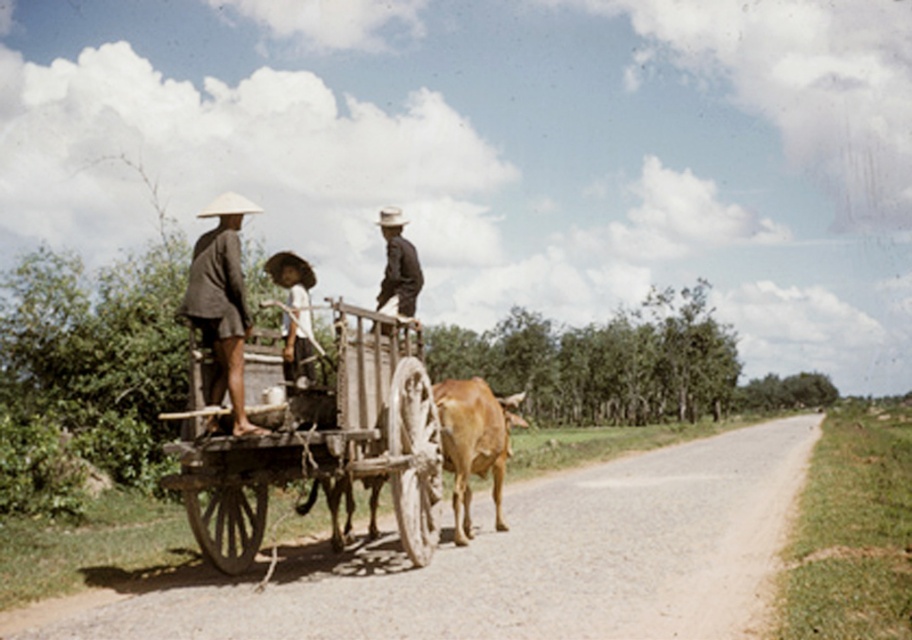
Can you confirm if brown woven hat at upper left is positioned below brown glossy bull at center?

Actually, brown woven hat at upper left is above brown glossy bull at center.

What do you see at coordinates (223, 304) in the screenshot? I see `brown woven hat at upper left` at bounding box center [223, 304].

Locate an element on the screen. The width and height of the screenshot is (912, 640). brown woven hat at upper left is located at coordinates (223, 304).

How distant is brown glossy bull at center from brown straw hat at upper center?

brown glossy bull at center and brown straw hat at upper center are 11.15 feet apart from each other.

Who is positioned more to the right, brown glossy bull at center or brown straw hat at upper center?

brown glossy bull at center

You are a GUI agent. You are given a task and a screenshot of the screen. Output one action in this format:
    pyautogui.click(x=<x>, y=<y>)
    Task: Click on the brown glossy bull at center
    The image size is (912, 640).
    Given the screenshot: What is the action you would take?
    pyautogui.click(x=474, y=442)

From the picture: Who is higher up, brown woven hat at upper left or brown straw hat at upper center?

Positioned higher is brown woven hat at upper left.

Between brown woven hat at upper left and brown straw hat at upper center, which one has more height?

brown woven hat at upper left

The width and height of the screenshot is (912, 640). I want to click on brown woven hat at upper left, so click(x=223, y=304).